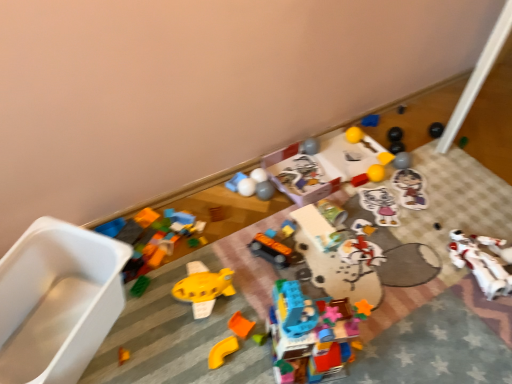
Find the location of a particular element. The width and height of the screenshot is (512, 384). vacant space that's between white plastic robot at lower right, which appears as the seventeenth toy when viewed from the left, and translucent plastic building blocks at center, which ranks as the ninth toy in right-to-left order is located at coordinates (407, 301).